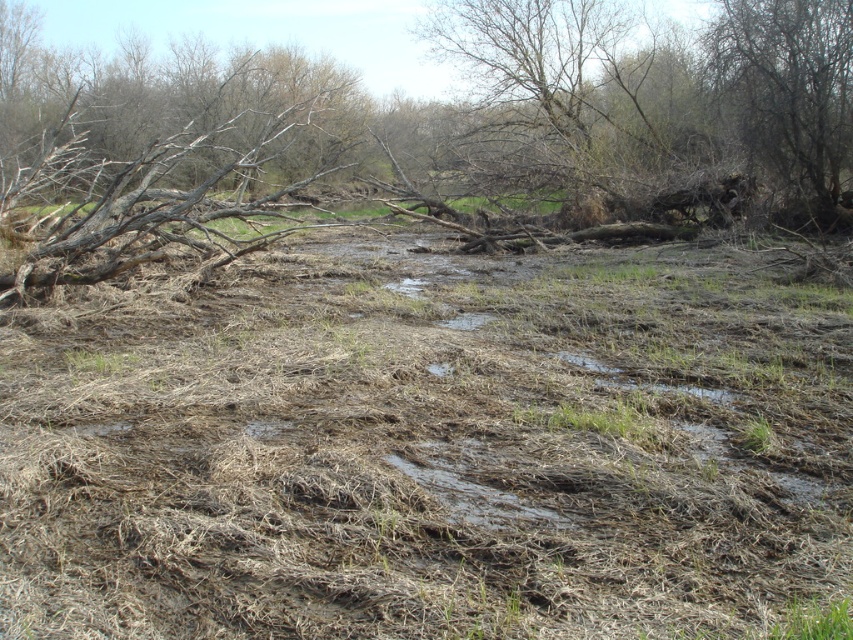
You are standing at the point labeled point [547,611] and want to cross the muddy area to reach the other side. The path you need to take is 2.62 meters long. If your boots can handle up to 2.5 meters of muddy terrain, will you be able to make it without sinking?

The path you need to take is 2.62 meters long, which exceeds the 2.5 meters your boots can handle. Therefore, you might sink in the muddy terrain.

You are a hiker who needs to cross the muddy area in the scene. You see brown dry grass at center and bare branches at upper right. How far apart are these two landmarks?

The brown dry grass at center is 38.49 feet from the bare branches at upper right, so the distance between them is 38.49 feet.

You are a hiker trying to cross the muddy area in the image. You notice brown dry grass at center and bare branches at upper right. Which object is closer to the ground?

The brown dry grass at center is positioned under bare branches at upper right, so the brown dry grass at center is closer to the ground.